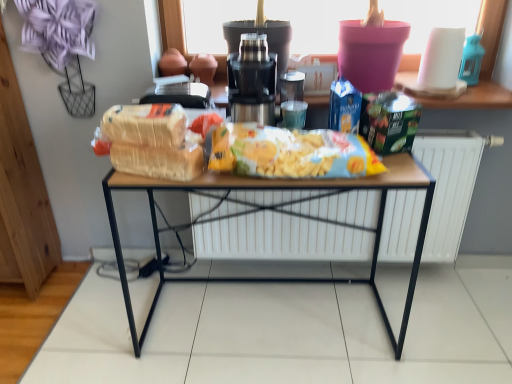
Question: From a real-world perspective, is metallic silver coffee machine at center physically located above or below wooden table at center?

Choices:
 (A) below
 (B) above

Answer: (B)

Question: Which is correct: metallic silver coffee machine at center is inside wooden table at center, or outside of it?

Choices:
 (A) outside
 (B) inside

Answer: (A)

Question: Based on their relative distances, which object is farther from the wooden table at center?

Choices:
 (A) metallic silver coffee machine at center
 (B) translucent plastic bag of cereal at center
 (C) yellow matte chips at center
 (D) white matte radiator at center
 (E) bread at center

Answer: (A)

Question: Estimate the real-world distances between objects in this image. Which object is farther from the bread at center?

Choices:
 (A) yellow matte chips at center
 (B) white matte radiator at center
 (C) translucent plastic bag of cereal at center
 (D) metallic silver coffee machine at center
 (E) wooden table at center

Answer: (B)